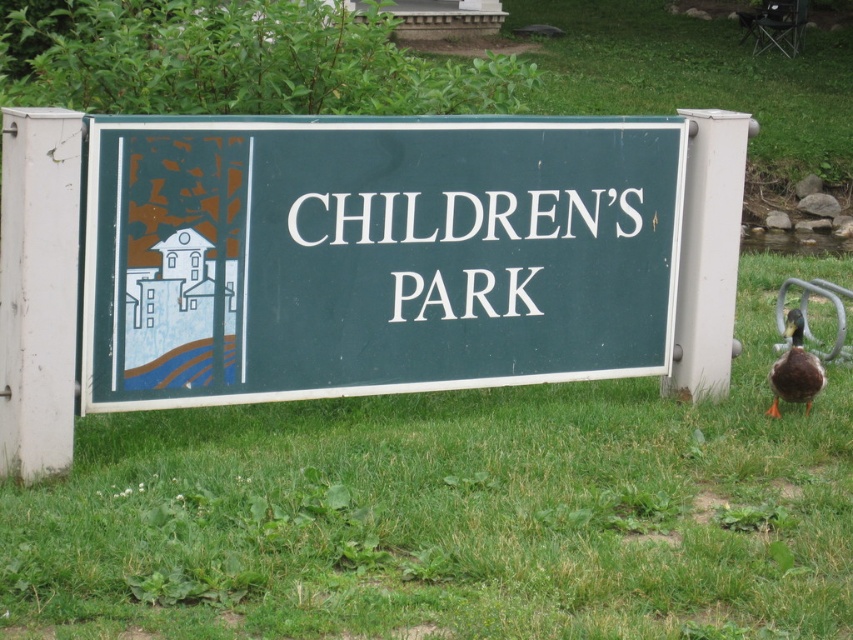
You are standing at the point with coordinates of 0.5, 0.5. You want to walk to the green grass at center. Which direction should you move?

The green grass at center is located at point (456,513). Since your current position is at (426,320), you should move to the right to reach the green grass at center.

You are a gardener who wants to mow the green grass at center. To ensure the lawnmower can pass under the green matte sign at center, you need to know the height difference between them. Based on the scene, which one is taller?

The green matte sign at center is taller than the green grass at center.